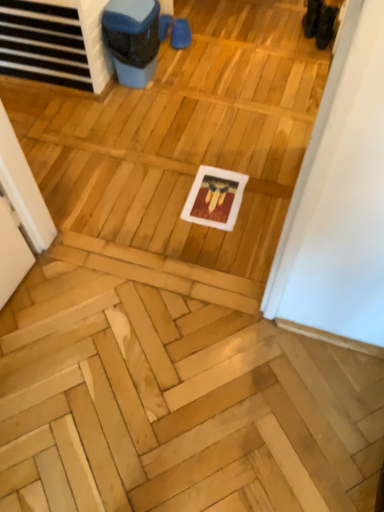
Question: Should I look upward or downward to see black suede shoes at upper right?

Choices:
 (A) down
 (B) up

Answer: (B)